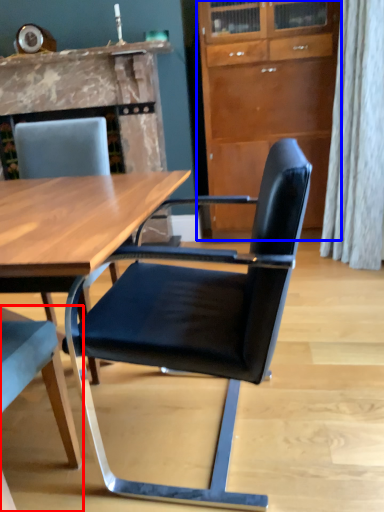
Question: Among these objects, which one is farthest to the camera, chair (highlighted by a red box) or cabinetry (highlighted by a blue box)?

Choices:
 (A) chair
 (B) cabinetry

Answer: (B)